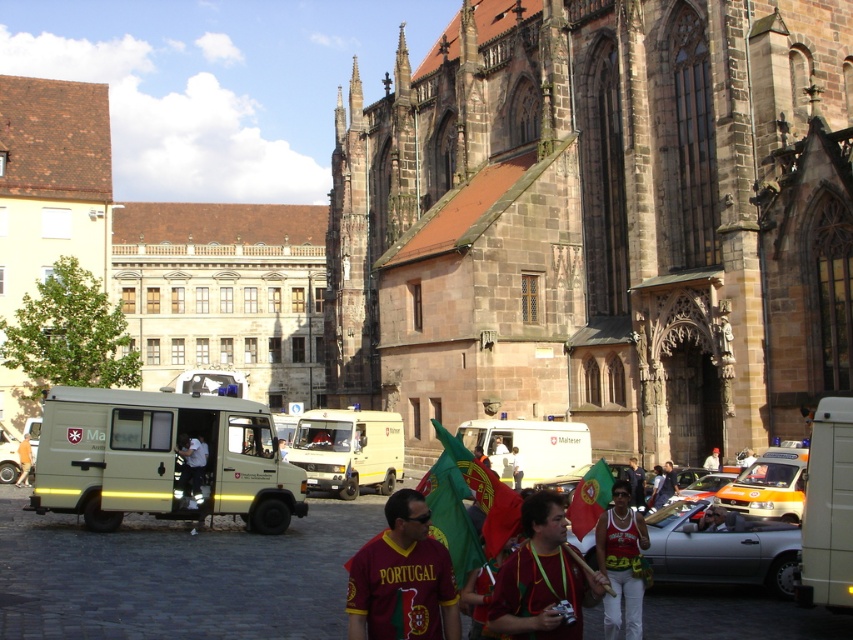
Based on the photo, you are a photographer trying to capture the entire dark brown stone church at center and orange cotton shirt at center in a single frame. Based on their sizes, which object should you focus on to ensure both are fully visible in the photo?

The dark brown stone church at center is wider than the orange cotton shirt at center, so you should focus on the church to ensure both are fully visible in the photo.

What are the coordinates of the dark brown stone church at center?

The dark brown stone church at center is located at coordinates point (601, 221).